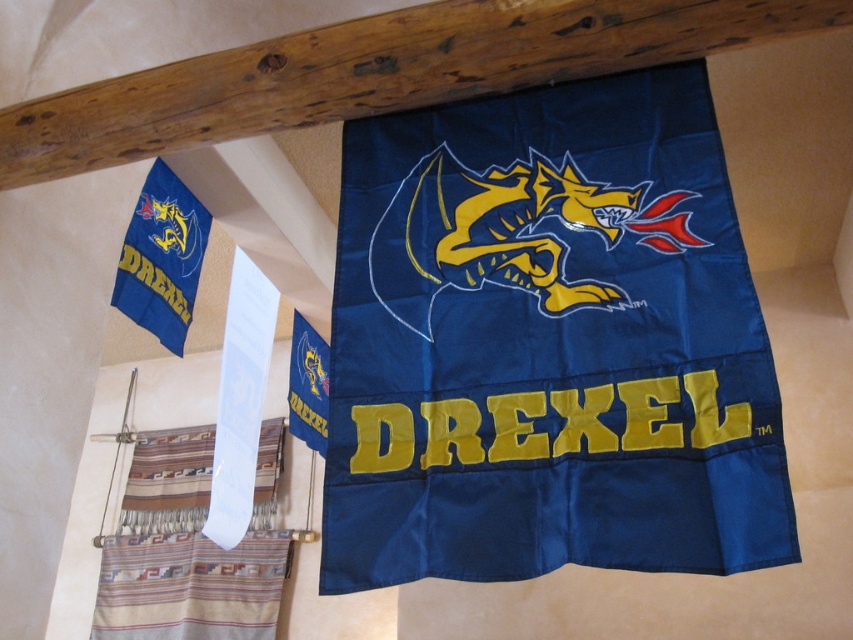
Consider the image. You are an interior designer planning to hang a new rectangular decorative item that is 1 meter wide. You want to place it on the wall between the navy blue fabric flag at center and the brown wooden beam at upper center. Based on the image, will the space between these two items be wide enough to fit your new item?

The navy blue fabric flag at center is thinner than the brown wooden beam at upper center. However, the question is about the space between them. Since the beam is at upper center and the flag is at center, the vertical distance between them might accommodate the 1m width, but without exact measurements, we can only infer based on their widths. Since the flag is thinner, maybe the space is wider. However, the answer should strictly use the given description. The description only states the flag is thinner,

You are an architect designing a new display layout. You need to hang a new banner that must be placed exactly at the center of the room. The room has a brown wooden beam at upper center. Where should you place the new banner to ensure it aligns with the center of the room?

The brown wooden beam at upper center is located at point (376, 72), so you should place the new banner at that coordinate to align with the center of the room.